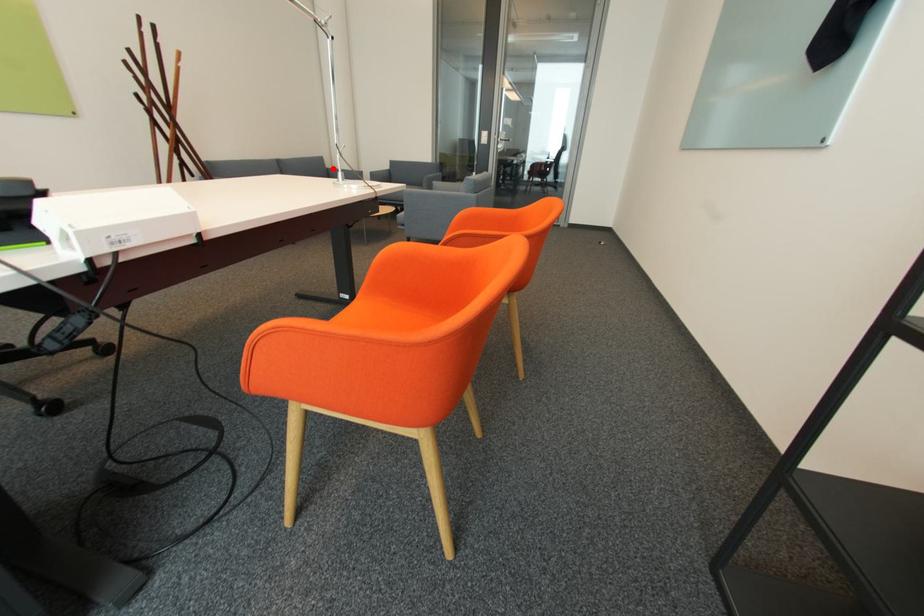
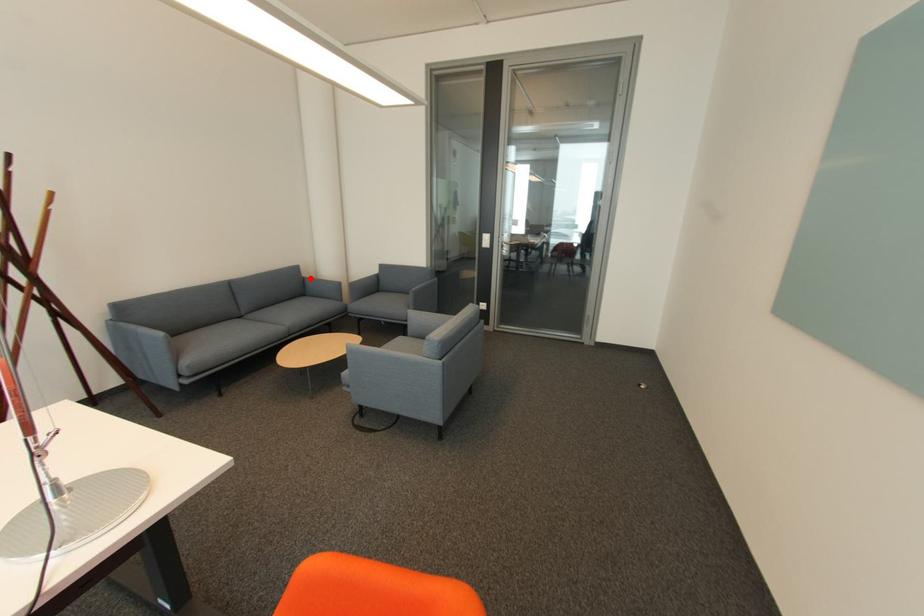
I am providing you with two images of the same scene from different viewpoints. A red point is marked on the first image and another point is marked on the second image. Does the point marked in image1 correspond to the same location as the one in image2?

Yes